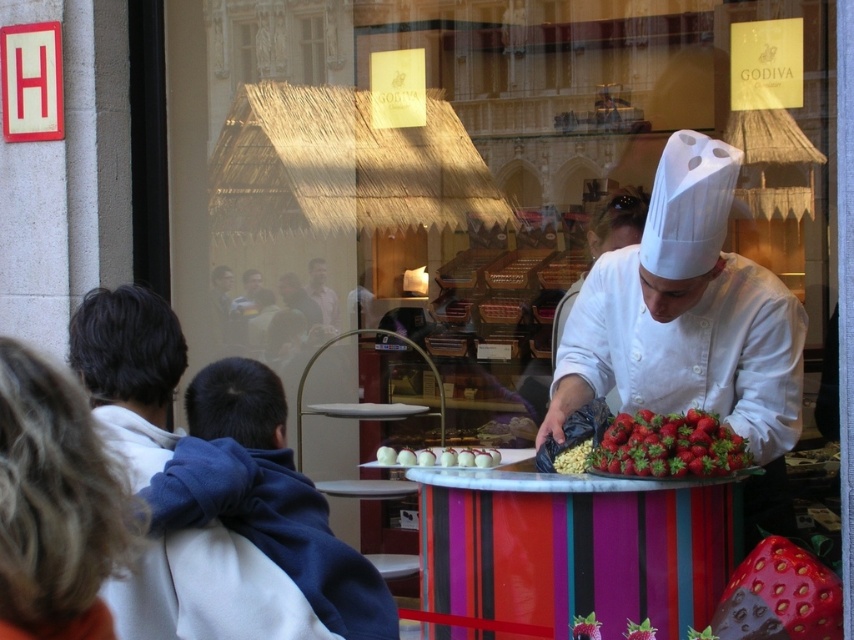
Question: Is shiny chocolate strawberry at center above white glossy chocolate at center?

Choices:
 (A) no
 (B) yes

Answer: (A)

Question: Which point is farther to the camera?

Choices:
 (A) smooth skin face at center
 (B) white glossy chocolate at center
 (C) white chef hat at center

Answer: (A)

Question: Estimate the real-world distances between objects in this image. Which object is farther from the white chef hat at center?

Choices:
 (A) smooth skin face at center
 (B) white glossy chocolate at center

Answer: (A)

Question: Can you confirm if white chef hat at center is positioned to the left of smooth skin face at center?

Choices:
 (A) no
 (B) yes

Answer: (A)

Question: Among these points, which one is farthest from the camera?

Choices:
 (A) (762, 564)
 (B) (378, 458)
 (C) (774, 481)

Answer: (C)

Question: Is white chef hat at center thinner than white glossy chocolate at center?

Choices:
 (A) yes
 (B) no

Answer: (B)